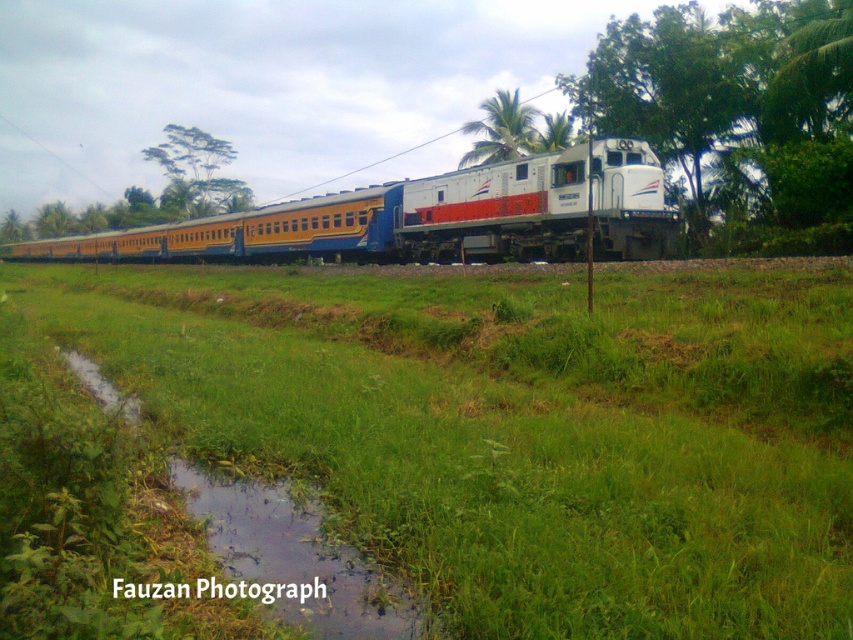
You are a passenger on the train and looking out the window. You see the green grassy at center and the green grassy puddle at lower center. Which of these two is closer to the train tracks?

The green grassy puddle at lower center is closer to the train tracks because it is shorter than the green grassy at center.

You are a bird flying above the train scene. You spot two green leafy trees at the upper center of the image. How far apart are the green leafy tree at upper center and the green leafy palm at upper center?

The distance between the green leafy tree at upper center and the green leafy palm at upper center is 154.04 feet.

You are standing at point (x=670, y=88) in the image. What object are you directly facing?

You are directly facing the green leafy tree at center located at point (x=670, y=88).